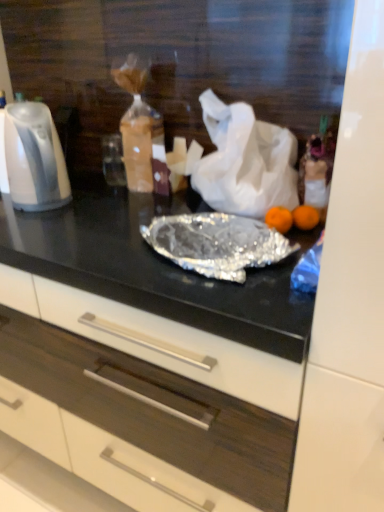
Question: Is point (4, 411) positioned closer to the camera than point (56, 198)?

Choices:
 (A) farther
 (B) closer

Answer: (A)

Question: Is white matte drawer at center spatially inside white glossy electric kettle at left, or outside of it?

Choices:
 (A) inside
 (B) outside

Answer: (B)

Question: Which object is the farthest from the white glossy electric kettle at left?

Choices:
 (A) white matte drawer at center
 (B) white matte plastic bag at center

Answer: (A)

Question: Which is nearer to the white glossy electric kettle at left?

Choices:
 (A) white matte drawer at center
 (B) white matte plastic bag at center

Answer: (B)